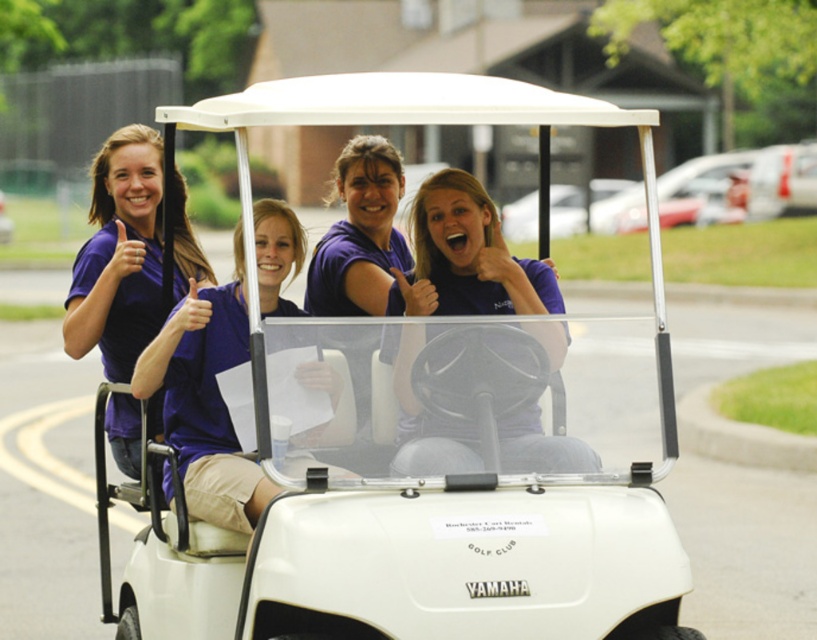
Question: Which object is farther from the camera taking this photo?

Choices:
 (A) white matte golf cart at center
 (B) matte purple shirt at left

Answer: (B)

Question: Which object is farther from the camera taking this photo?

Choices:
 (A) purple matte shirt at upper left
 (B) white matte golf cart at center

Answer: (A)

Question: Can you confirm if purple matte shirt at center is positioned above purple matte shirt at upper left?

Choices:
 (A) yes
 (B) no

Answer: (A)

Question: Which point is closer to the camera?

Choices:
 (A) (557, 458)
 (B) (188, 250)

Answer: (A)

Question: Can you confirm if purple matte shirt at center is positioned above purple matte shirt at upper left?

Choices:
 (A) yes
 (B) no

Answer: (A)

Question: Can you confirm if white matte golf cart at center is positioned to the left of purple matte shirt at upper left?

Choices:
 (A) yes
 (B) no

Answer: (B)